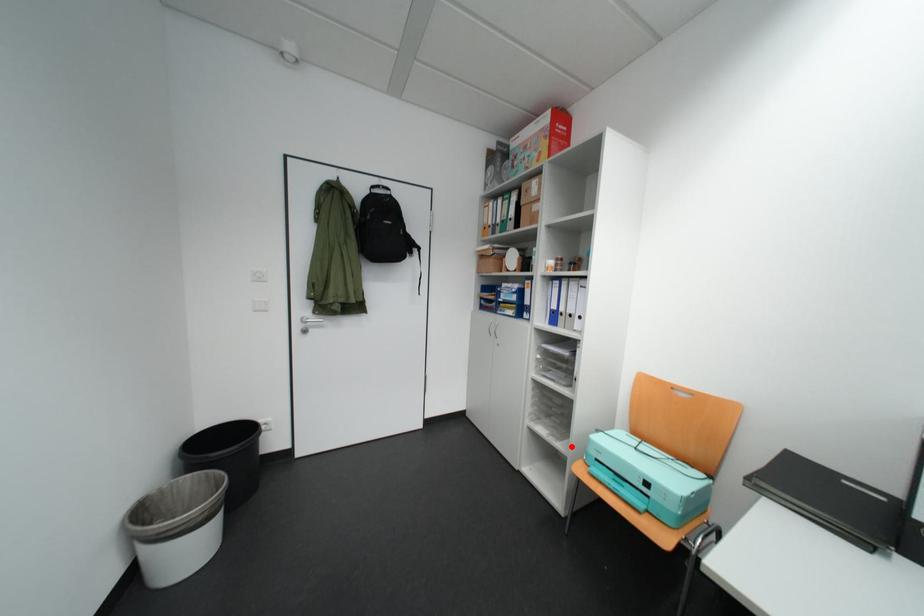
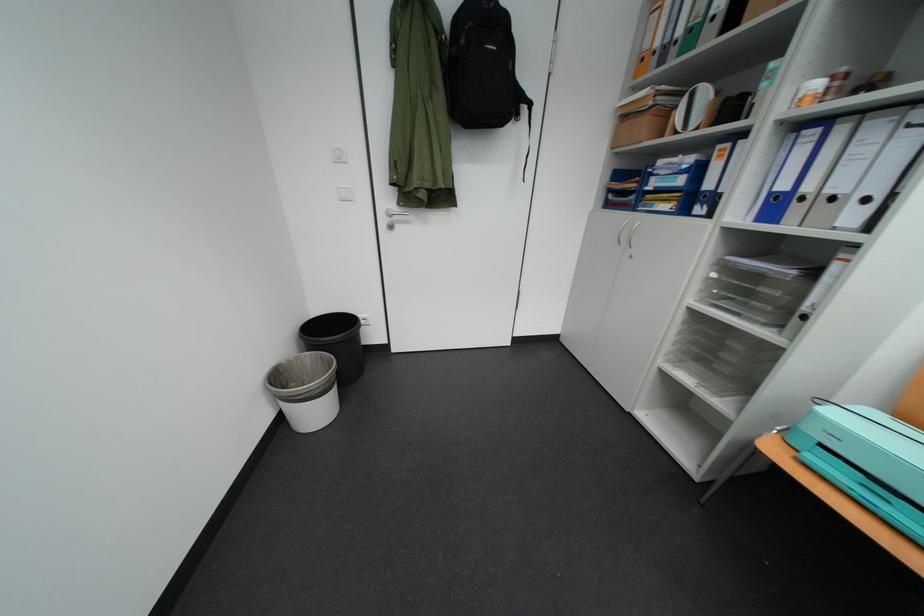
Find the pixel in the second image that matches the highlighted location in the first image.

(730, 403)